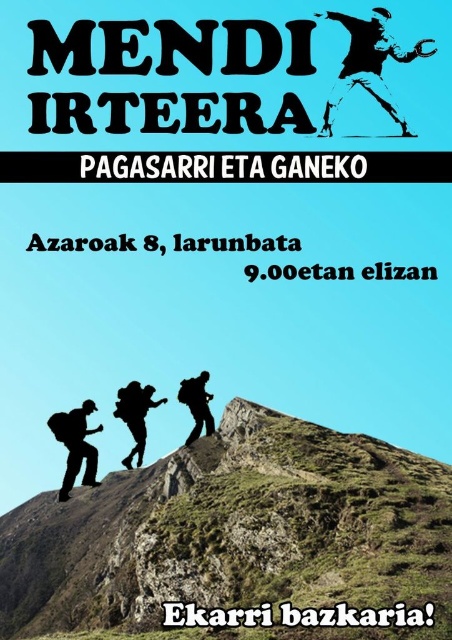
Is the position of black matte backpack at center less distant than that of matte black backpack at center?

No, it is not.

Is point (117, 412) closer to viewer compared to point (197, 392)?

Yes, point (117, 412) is closer to viewer.

Image resolution: width=452 pixels, height=640 pixels. Identify the location of black matte backpack at center. (136, 416).

Measure the distance between point (352, 81) and camera.

The distance of point (352, 81) from camera is 40.89 meters.

Locate an element on the screen. Image resolution: width=452 pixels, height=640 pixels. black silhouette at upper center is located at coordinates (370, 67).

Between point (366, 61) and point (187, 436), which one is positioned behind?

Point (366, 61)

Locate an element on the screen. black silhouette at upper center is located at coordinates (370, 67).

Is black matte backpack at lower left closer to the viewer compared to matte black backpack at center?

Yes, it is.

Is black matte backpack at lower left taller than matte black backpack at center?

Indeed, black matte backpack at lower left has a greater height compared to matte black backpack at center.

Image resolution: width=452 pixels, height=640 pixels. What do you see at coordinates (75, 445) in the screenshot?
I see `black matte backpack at lower left` at bounding box center [75, 445].

Where is `black matte backpack at lower left`? This screenshot has width=452, height=640. black matte backpack at lower left is located at coordinates (75, 445).